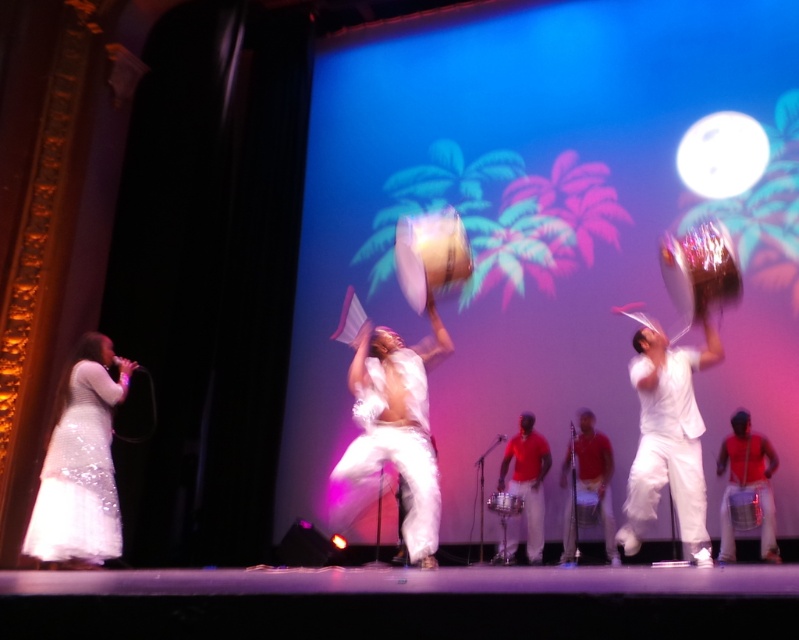
You are a stagehand who needs to place a new microphone stand that is 1.2 meters tall. You want to ensure it doesn not block the view of the shiny red drum at right and the red cotton shirt at center. Based on their heights, can you place the stand between them?

The shiny red drum at right has a lesser height compared to the red cotton shirt at center. Since the microphone stand is 1.2 meters tall, it might block the view of the shorter shiny red drum at right but not the taller red cotton shirt at center. To avoid blocking both, place the stand closer to the drum where its height won t obstruct the view of the shirt.

Looking at this image, you are a stagehand who needs to adjust the microphone stand between the shiny red drum at right and the red cotton shirt at center. The stand requires at least 1.2 meters of space to be safely placed. Based on the description, can you place it there?

The shiny red drum at right is 1.06 meters away from the red cotton shirt at center. Since the required space is 1.2 meters, the microphone stand cannot be safely placed between them.

You are a stagehand preparing to adjust the lighting for the performance. You need to position a spotlight on the shiny red drum at right without shining it on the red cotton shirt at center. Based on their positions, can you do this?

The shiny red drum at right is above the red cotton shirt at center, so yes, you can position the spotlight on the shiny red drum at right without affecting the red cotton shirt at center by angling it upwards.